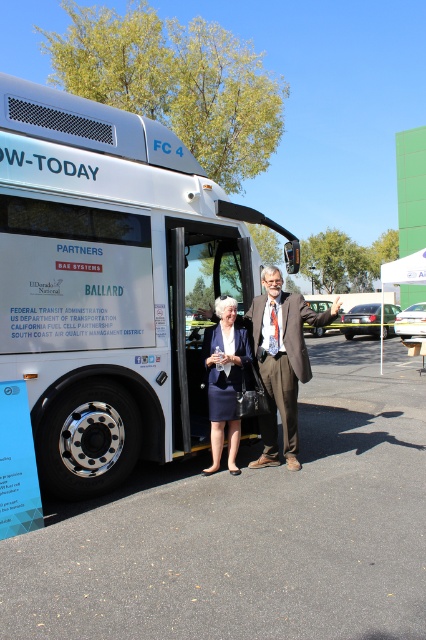
Between brown textured suit at center and navy blue skirt at center, which one has less height?

navy blue skirt at center

Which of these two, brown textured suit at center or navy blue skirt at center, stands taller?

With more height is brown textured suit at center.

In order to click on brown textured suit at center in this screenshot , I will do `click(282, 362)`.

Can you confirm if asphalt at lower center is positioned below navy blue skirt at center?

Correct, asphalt at lower center is located below navy blue skirt at center.

Does asphalt at lower center appear on the left side of navy blue skirt at center?

No, asphalt at lower center is not to the left of navy blue skirt at center.

Find the location of a particular element. The width and height of the screenshot is (426, 640). asphalt at lower center is located at coordinates (250, 529).

Who is positioned more to the right, asphalt at lower center or white plastic bus stop at center?

Positioned to the right is white plastic bus stop at center.

Between asphalt at lower center and white plastic bus stop at center, which one is positioned lower?

asphalt at lower center is below.

Measure the distance between point (x=382, y=636) and camera.

Point (x=382, y=636) and camera are 8.59 feet apart.

Where is `asphalt at lower center`? Image resolution: width=426 pixels, height=640 pixels. asphalt at lower center is located at coordinates (250, 529).